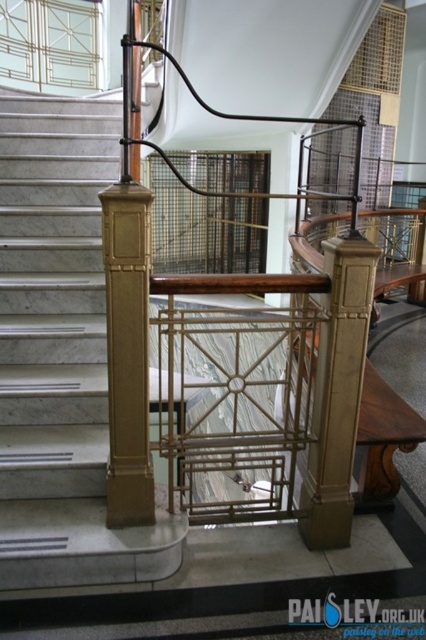
Question: Does matte gold stair at left have a lesser width compared to gold polished wood pillar at center?

Choices:
 (A) no
 (B) yes

Answer: (A)

Question: Which of the following is the closest to the observer?

Choices:
 (A) matte gold stair at left
 (B) gold polished wood pillar at center

Answer: (B)

Question: Among these objects, which one is nearest to the camera?

Choices:
 (A) gold polished wood pillar at center
 (B) matte gold stair at left

Answer: (A)

Question: Is matte gold stair at left bigger than gold polished wood pillar at center?

Choices:
 (A) yes
 (B) no

Answer: (A)

Question: Does matte gold stair at left have a greater width compared to gold polished wood pillar at center?

Choices:
 (A) no
 (B) yes

Answer: (B)

Question: Which point is farther to the camera?

Choices:
 (A) matte gold stair at left
 (B) gold polished wood pillar at center

Answer: (A)